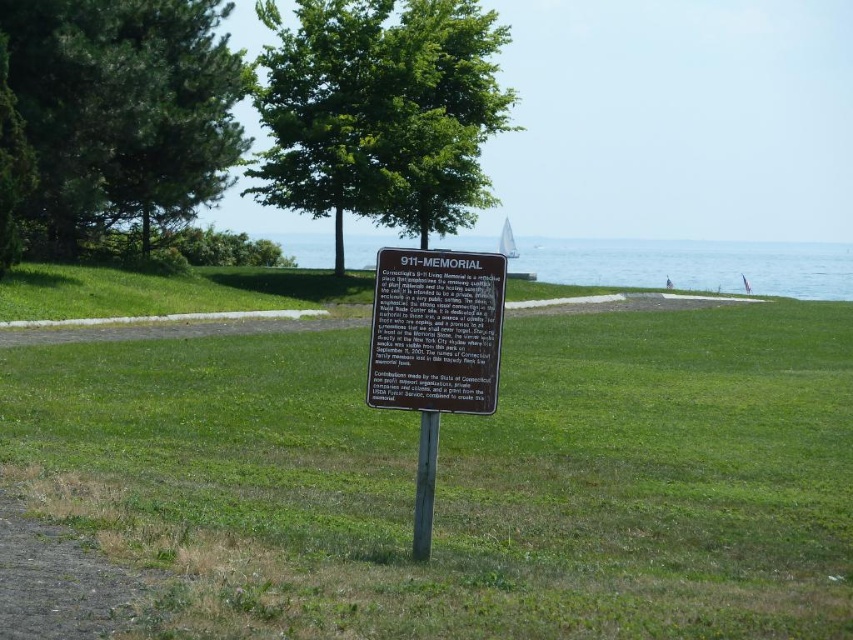
Question: In this image, where is blue water at center located relative to dull gray gravel at lower left?

Choices:
 (A) below
 (B) above

Answer: (B)

Question: Which of these objects is positioned farthest from the blue water at center?

Choices:
 (A) dull gray gravel at lower left
 (B) green leafy tree at upper center

Answer: (A)

Question: Is green grass at center wider than green textured pine tree at upper left?

Choices:
 (A) no
 (B) yes

Answer: (B)

Question: Estimate the real-world distances between objects in this image. Which object is closer to the dull gray gravel at lower left?

Choices:
 (A) green grass at center
 (B) brown wooden sign at center

Answer: (B)

Question: Does green textured pine tree at upper left appear under brown wooden sign at center?

Choices:
 (A) yes
 (B) no

Answer: (B)

Question: Estimate the real-world distances between objects in this image. Which object is farther from the green leafy tree at upper center?

Choices:
 (A) brown wooden sign at center
 (B) blue water at center
 (C) green grass at center
 (D) green textured pine tree at upper left

Answer: (A)